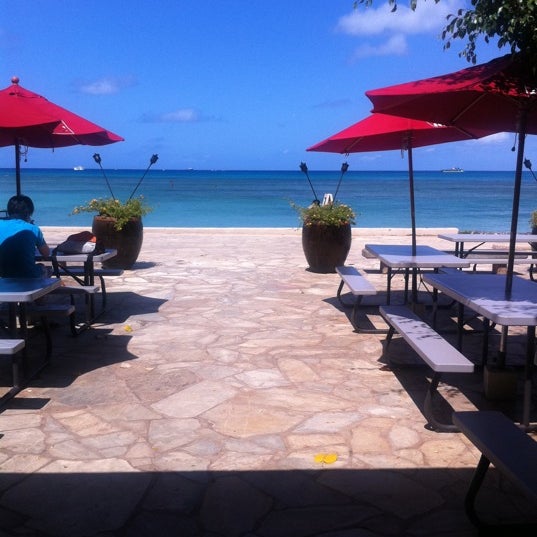
This screenshot has width=537, height=537. I want to click on plant, so click(x=329, y=215), click(x=116, y=213).